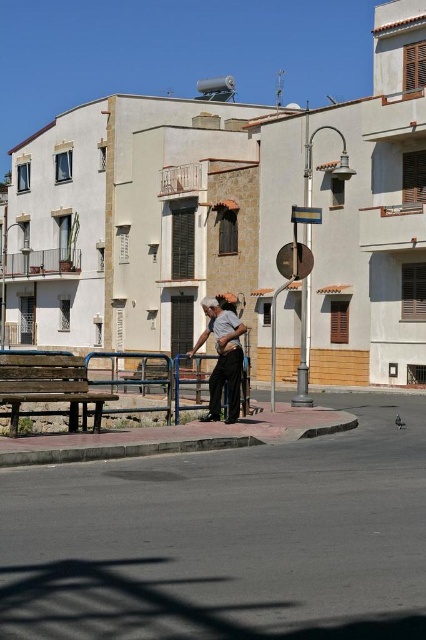
Who is taller, wooden bench at lower left or dark gray fabric pants at center?

Standing taller between the two is dark gray fabric pants at center.

From the picture: Between wooden bench at lower left and dark gray fabric pants at center, which one appears on the left side from the viewer's perspective?

From the viewer's perspective, wooden bench at lower left appears more on the left side.

Does point (60, 401) come farther from viewer compared to point (218, 348)?

No.

The image size is (426, 640). I want to click on wooden bench at lower left, so click(48, 387).